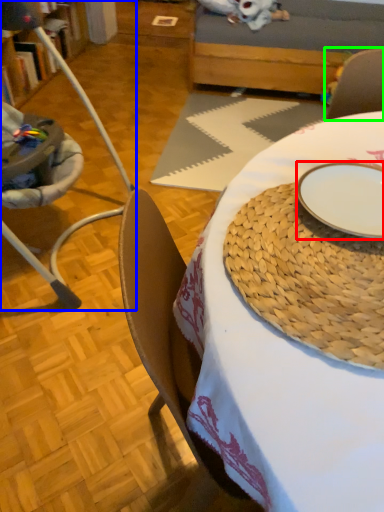
Question: Estimate the real-world distances between objects in this image. Which object is farther from plate (highlighted by a red box), chair (highlighted by a blue box) or armchair (highlighted by a green box)?

Choices:
 (A) chair
 (B) armchair

Answer: (A)